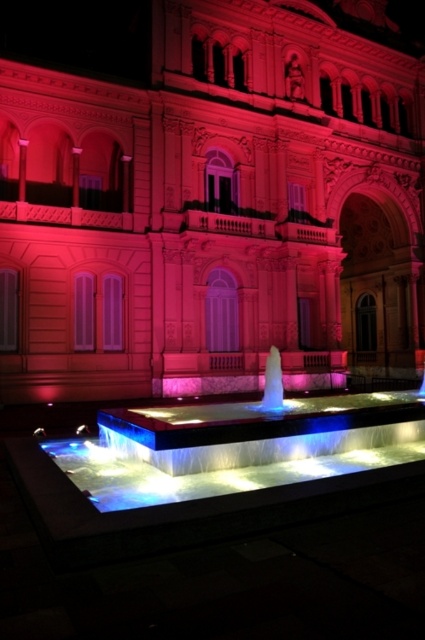
Question: Among these objects, which one is farthest from the camera?

Choices:
 (A) matte pink stone palace at center
 (B) illuminated glass water feature at center
 (C) illuminated glass fountain at center

Answer: (A)

Question: Can you confirm if matte pink stone palace at center is positioned below illuminated glass fountain at center?

Choices:
 (A) no
 (B) yes

Answer: (A)

Question: Can you confirm if illuminated glass water feature at center is thinner than illuminated glass fountain at center?

Choices:
 (A) yes
 (B) no

Answer: (B)

Question: Which point is closer to the camera taking this photo?

Choices:
 (A) (269, 385)
 (B) (115, 205)
 (C) (320, 444)

Answer: (C)

Question: Is illuminated glass water feature at center thinner than illuminated glass fountain at center?

Choices:
 (A) no
 (B) yes

Answer: (A)

Question: Which object appears closest to the camera in this image?

Choices:
 (A) illuminated glass water feature at center
 (B) matte pink stone palace at center

Answer: (A)